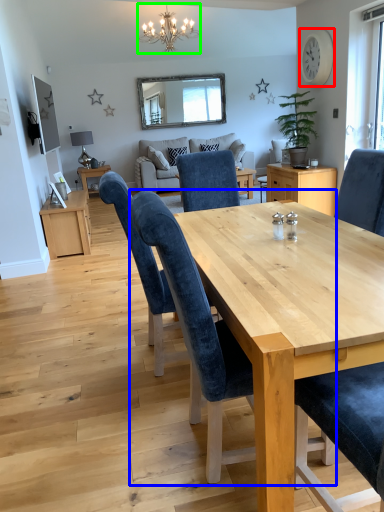
Question: Which is farther away from clock (highlighted by a red box)? chair (highlighted by a blue box) or light fixture (highlighted by a green box)?

Choices:
 (A) chair
 (B) light fixture

Answer: (A)